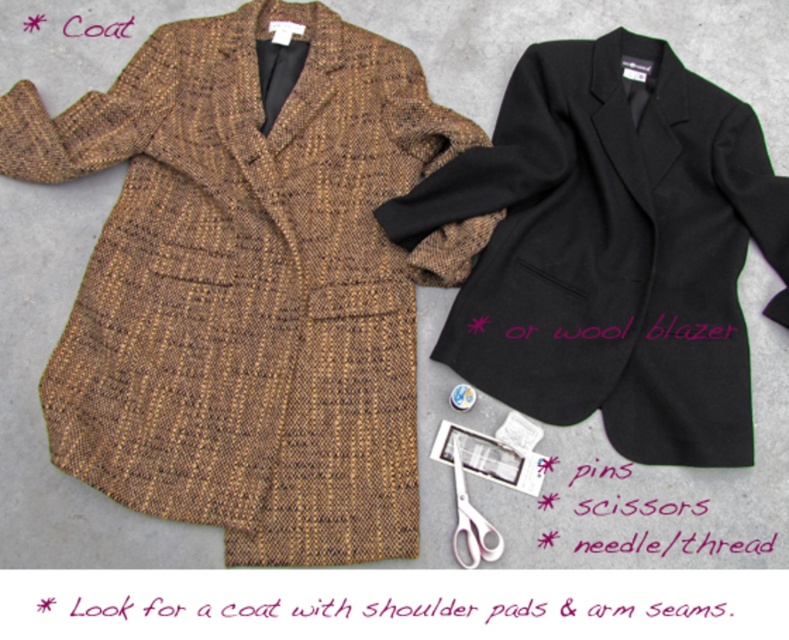
Question: Which object is positioned farthest from the pink plastic scissors at lower center?

Choices:
 (A) brown tweed coat at upper left
 (B) black wool blazer at upper right

Answer: (A)

Question: Can you confirm if brown tweed coat at upper left is thinner than pink plastic scissors at lower center?

Choices:
 (A) yes
 (B) no

Answer: (B)

Question: Does black wool blazer at upper right appear over pink plastic scissors at lower center?

Choices:
 (A) no
 (B) yes

Answer: (B)

Question: From the image, what is the correct spatial relationship of brown tweed coat at upper left in relation to pink plastic scissors at lower center?

Choices:
 (A) below
 (B) above

Answer: (B)

Question: Estimate the real-world distances between objects in this image. Which object is farther from the pink plastic scissors at lower center?

Choices:
 (A) brown tweed coat at upper left
 (B) black wool blazer at upper right

Answer: (A)

Question: Which object appears farthest from the camera in this image?

Choices:
 (A) brown tweed coat at upper left
 (B) pink plastic scissors at lower center

Answer: (B)